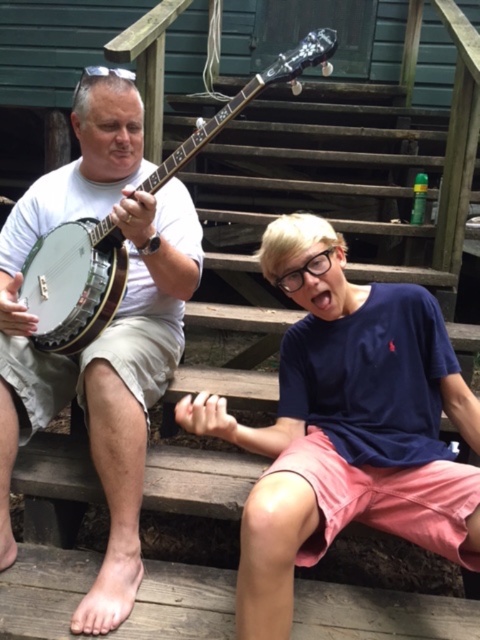
From the picture: Is blue cotton shirt at center above white wooden banjo at upper center?

Actually, blue cotton shirt at center is below white wooden banjo at upper center.

Is point (431, 342) less distant than point (98, 237)?

Yes, it is in front of point (98, 237).

This screenshot has height=640, width=480. Describe the element at coordinates (350, 364) in the screenshot. I see `blue cotton shirt at center` at that location.

This screenshot has width=480, height=640. Find the location of `blue cotton shirt at center`. blue cotton shirt at center is located at coordinates (350, 364).

Is matte white banjo at left positioned in front of white wooden banjo at upper center?

No, it is behind white wooden banjo at upper center.

Does matte white banjo at left lie behind white wooden banjo at upper center?

Yes, matte white banjo at left is further from the viewer.

Identify the location of matte white banjo at left. (105, 330).

Between point (326, 490) and point (103, 442), which one is positioned behind?

The point (103, 442) is more distant.

The image size is (480, 640). What are the coordinates of `blue cotton shirt at center` in the screenshot? It's located at (350, 364).

Is point (467, 547) closer to camera compared to point (179, 353)?

Yes, point (467, 547) is in front of point (179, 353).

The width and height of the screenshot is (480, 640). I want to click on blue cotton shirt at center, so click(350, 364).